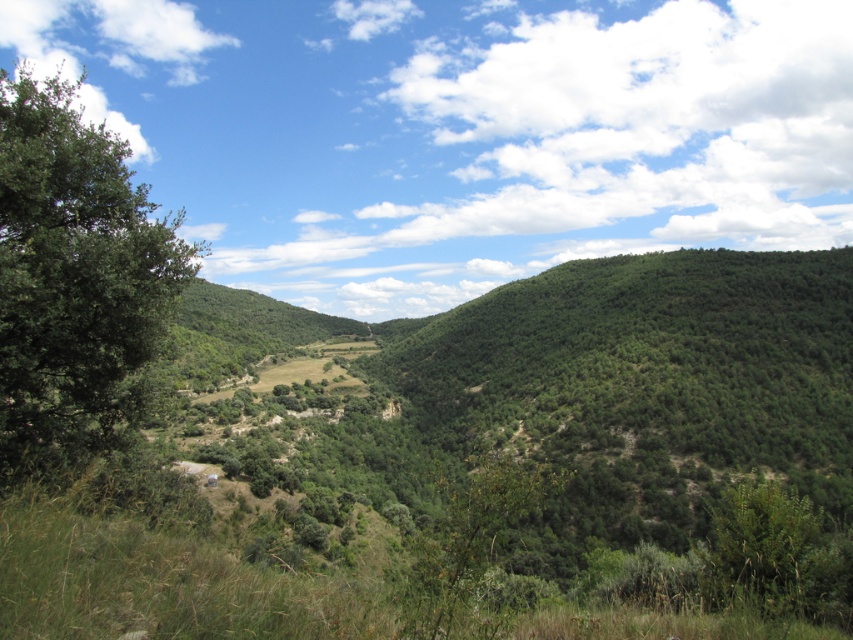
You are standing at the point marked as point (74,280) in the image. What object is located exactly at that point?

The green leafy tree at left is located exactly at point (74,280).

You are a hiker standing in the valley and want to take a photo of both the green leafy shrub at lower right and the green leafy shrub at center. Which shrub should you focus on first to ensure both are in the frame?

You should focus on the green leafy shrub at lower right first because it is closer to you than the green leafy shrub at center, so adjusting the camera to include both would require starting with the closer one.

You are standing in the middle of the valley and see the green leafy tree at left and the green leafy shrub at lower right. Which one is closer to your left side?

The green leafy tree at left is positioned on the left side of green leafy shrub at lower right, so the green leafy tree at left is closer to your left side.